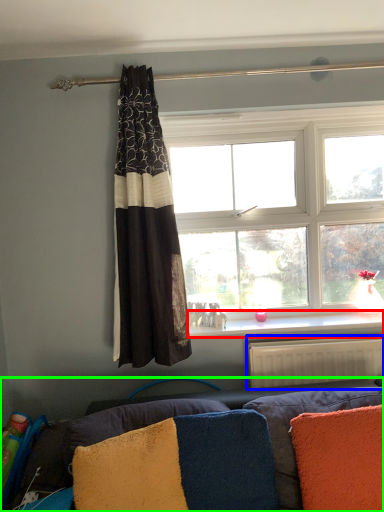
Question: Based on their relative distances, which object is farther from window sill (highlighted by a red box)? Choose from radiator (highlighted by a blue box) and studio couch (highlighted by a green box).

Choices:
 (A) radiator
 (B) studio couch

Answer: (B)